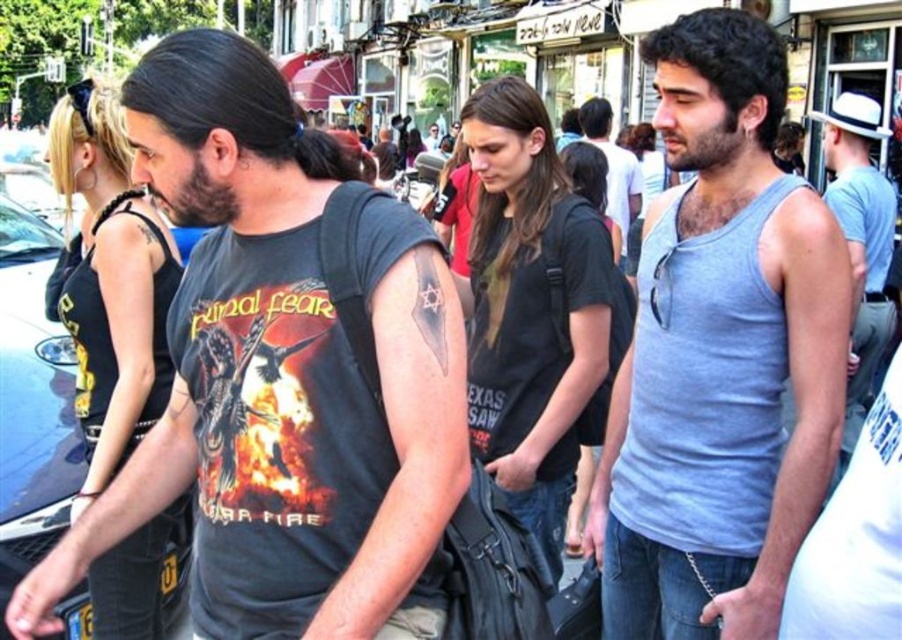
Question: Can you confirm if dark gray t-shirt at left is bigger than gray tank top at center?

Choices:
 (A) yes
 (B) no

Answer: (A)

Question: Which point appears closest to the camera in this image?

Choices:
 (A) (606, 182)
 (B) (320, 388)

Answer: (B)

Question: Does gray cotton tank top at center have a smaller size compared to metallic blue car at left?

Choices:
 (A) yes
 (B) no

Answer: (A)

Question: Which point appears closest to the camera in this image?

Choices:
 (A) click(852, 272)
 (B) click(610, 198)
 (C) click(649, 614)

Answer: (C)

Question: Estimate the real-world distances between objects in this image. Which object is closer to the dark gray t-shirt at left?

Choices:
 (A) metallic blue car at left
 (B) gray tank top at center

Answer: (A)

Question: Can you confirm if gray cotton tank top at center is positioned above metallic blue car at left?

Choices:
 (A) yes
 (B) no

Answer: (B)